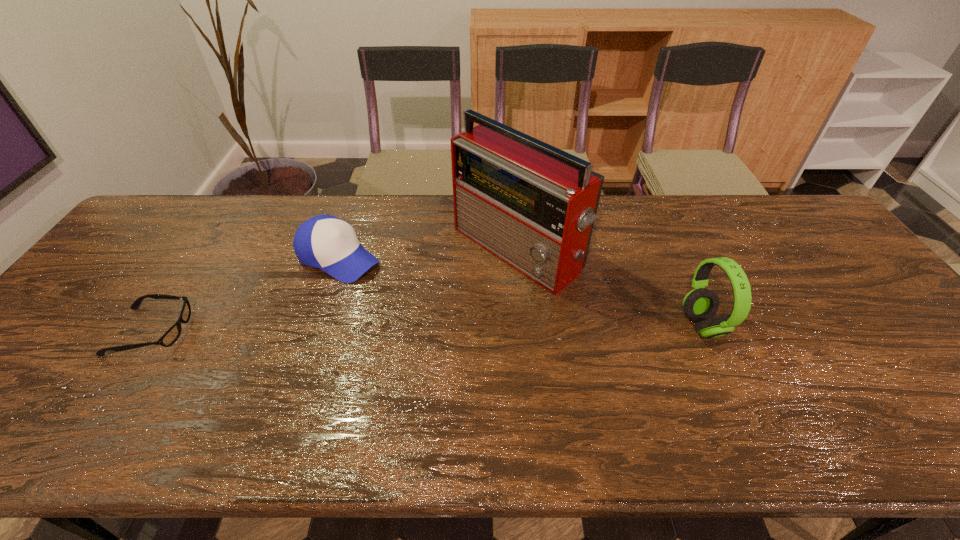
Locate an element on the screen. This screenshot has width=960, height=540. blank region between the headset and the baseball cap is located at coordinates click(520, 292).

You are a GUI agent. You are given a task and a screenshot of the screen. Output one action in this format:
    pyautogui.click(x=<x>, y=<y>)
    Task: Click on the vacant area between the headset and the tallest object
    The width and height of the screenshot is (960, 540).
    Given the screenshot: What is the action you would take?
    pyautogui.click(x=610, y=287)

Locate an element on the screen. free space between the spectacles and the headset is located at coordinates (427, 328).

Where is `vacant region between the second tallest object and the third tallest object`? This screenshot has height=540, width=960. vacant region between the second tallest object and the third tallest object is located at coordinates (520, 292).

Identify which object is the second closest to the spectacles. Please provide its 2D coordinates. Your answer should be formatted as a tuple, i.e. [(x, y)], where the tuple contains the x and y coordinates of a point satisfying the conditions above.

[(530, 204)]

Select which object appears as the closest to the tallest object. Please provide its 2D coordinates. Your answer should be formatted as a tuple, i.e. [(x, y)], where the tuple contains the x and y coordinates of a point satisfying the conditions above.

[(326, 242)]

The image size is (960, 540). Identify the location of free region that satisfies the following two spatial constraints: 1. on the front side of the third shortest object; 2. on the left side of the third object from right to left. (316, 326).

At what (x,y) coordinates should I click in order to perform the action: click on free space that satisfies the following two spatial constraints: 1. on the back side of the third object from right to left; 2. on the right side of the third object from left to right. Please return your answer as a coordinate pair (x, y). Looking at the image, I should click on (342, 249).

Identify the location of vacant space that satisfies the following two spatial constraints: 1. on the back side of the third object from left to right; 2. on the right side of the baseball cap. The image size is (960, 540). (342, 249).